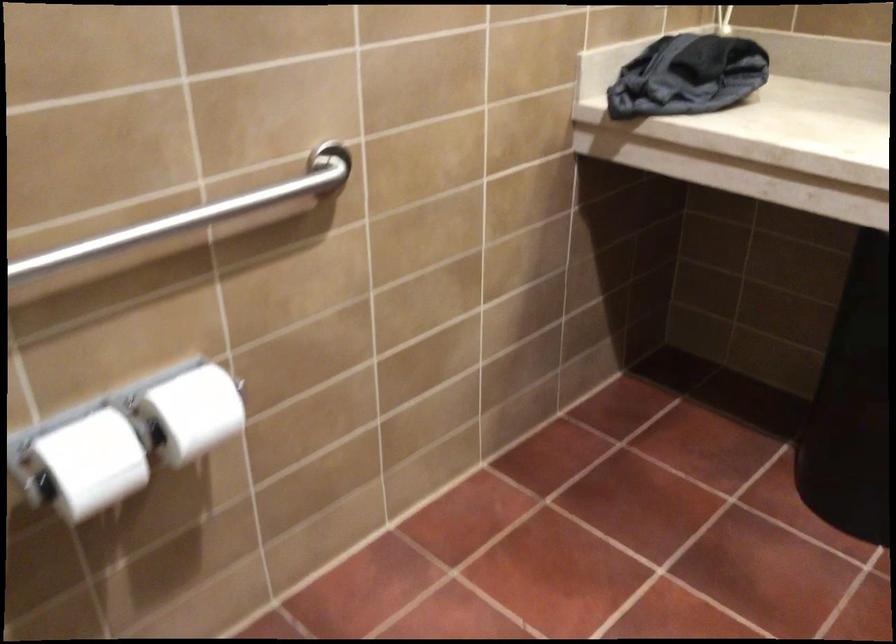
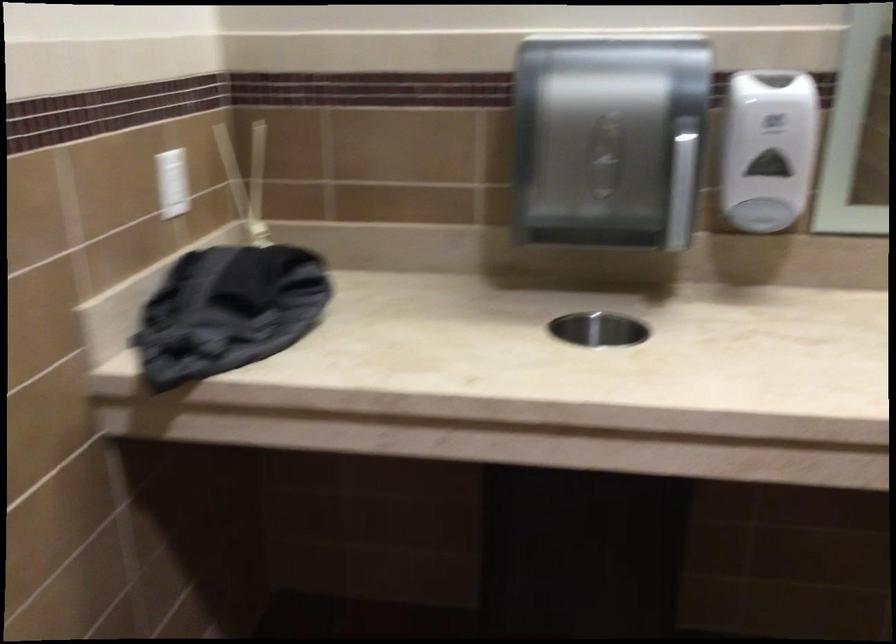
Question: The first image is from the beginning of the video and the second image is from the end. How did the camera likely rotate when shooting the video?

Choices:
 (A) Left
 (B) Right
 (C) Up
 (D) Down

Answer: (B)